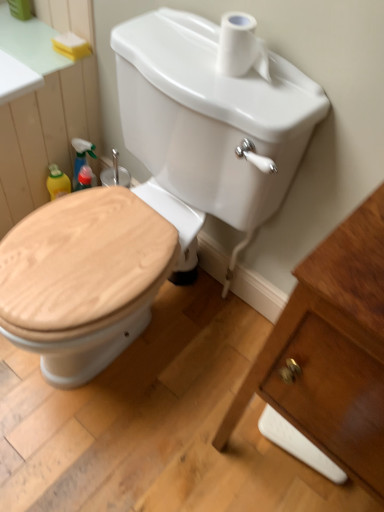
Question: From a real-world perspective, is white glossy porcelain at right physically below yellow sponge at upper left?

Choices:
 (A) no
 (B) yes

Answer: (B)

Question: Can you confirm if white glossy porcelain at right is bigger than yellow sponge at upper left?

Choices:
 (A) no
 (B) yes

Answer: (B)

Question: Does white glossy porcelain at right have a greater width compared to yellow sponge at upper left?

Choices:
 (A) no
 (B) yes

Answer: (B)

Question: Is white glossy porcelain at right positioned with its back to yellow sponge at upper left?

Choices:
 (A) no
 (B) yes

Answer: (A)

Question: Considering the relative sizes of white glossy porcelain at right and yellow sponge at upper left in the image provided, is white glossy porcelain at right taller than yellow sponge at upper left?

Choices:
 (A) no
 (B) yes

Answer: (B)

Question: From the image's perspective, is white glossy porcelain at right below yellow sponge at upper left?

Choices:
 (A) no
 (B) yes

Answer: (B)

Question: From the image's perspective, is yellow sponge at upper left under white matte toilet paper at upper center?

Choices:
 (A) no
 (B) yes

Answer: (A)

Question: Is yellow sponge at upper left at the right side of white matte toilet paper at upper center?

Choices:
 (A) no
 (B) yes

Answer: (A)

Question: Considering the relative sizes of yellow sponge at upper left and white matte toilet paper at upper center in the image provided, is yellow sponge at upper left bigger than white matte toilet paper at upper center?

Choices:
 (A) yes
 (B) no

Answer: (B)

Question: Is yellow sponge at upper left oriented away from white matte toilet paper at upper center?

Choices:
 (A) no
 (B) yes

Answer: (A)

Question: Is yellow sponge at upper left closer to camera compared to white matte toilet paper at upper center?

Choices:
 (A) yes
 (B) no

Answer: (B)

Question: Could you tell me if yellow sponge at upper left is facing white matte toilet paper at upper center?

Choices:
 (A) no
 (B) yes

Answer: (A)

Question: Is wooden toilet seat at center bigger than yellow sponge at upper left?

Choices:
 (A) no
 (B) yes

Answer: (B)